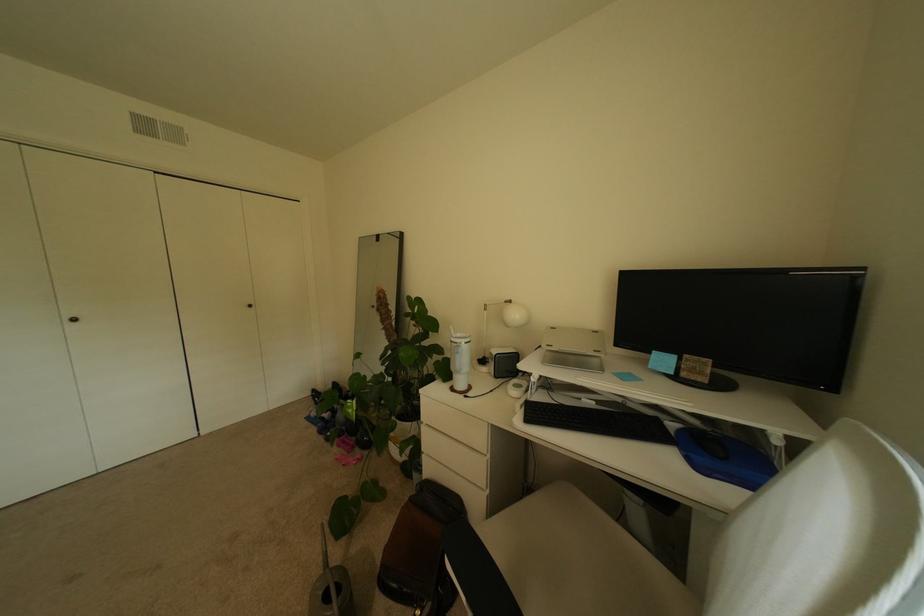
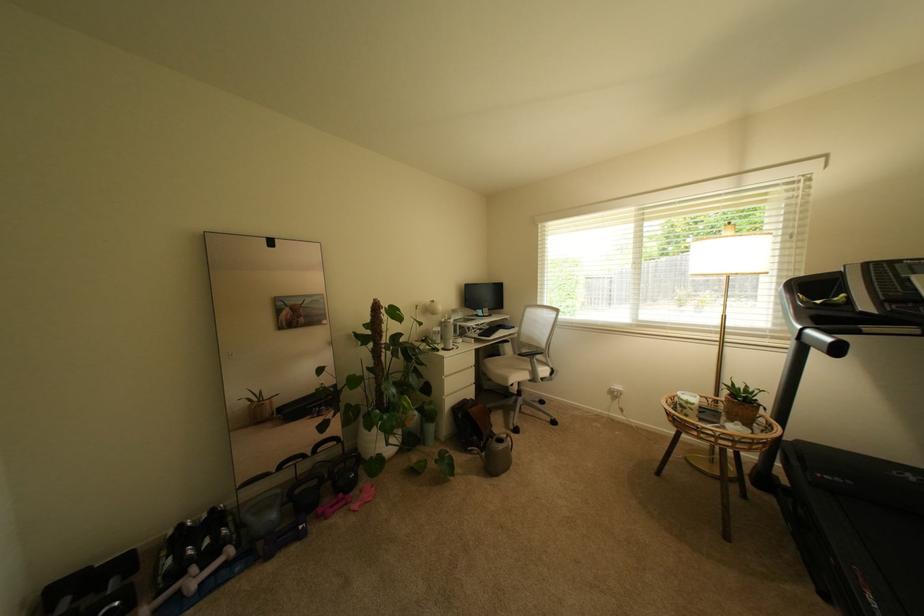
The point at (353, 444) is marked in the first image. Where is the corresponding point in the second image?

(339, 508)